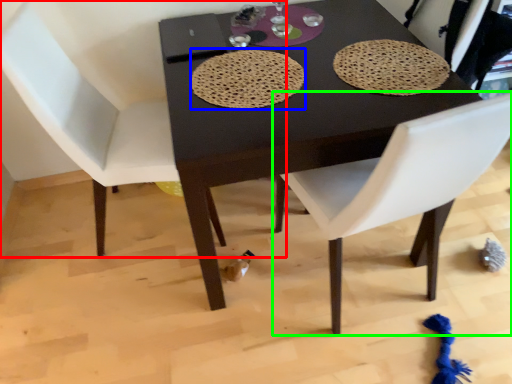
Question: Estimate the real-world distances between objects in this image. Which object is farther from chair (highlighted by a red box), mat (highlighted by a blue box) or chair (highlighted by a green box)?

Choices:
 (A) mat
 (B) chair

Answer: (B)